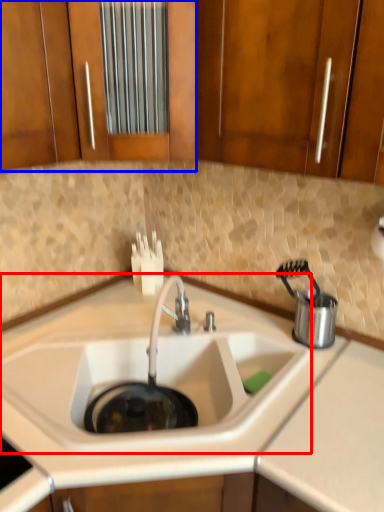
Question: Which object appears farthest to the camera in this image, sink (highlighted by a red box) or cabinetry (highlighted by a blue box)?

Choices:
 (A) sink
 (B) cabinetry

Answer: (B)